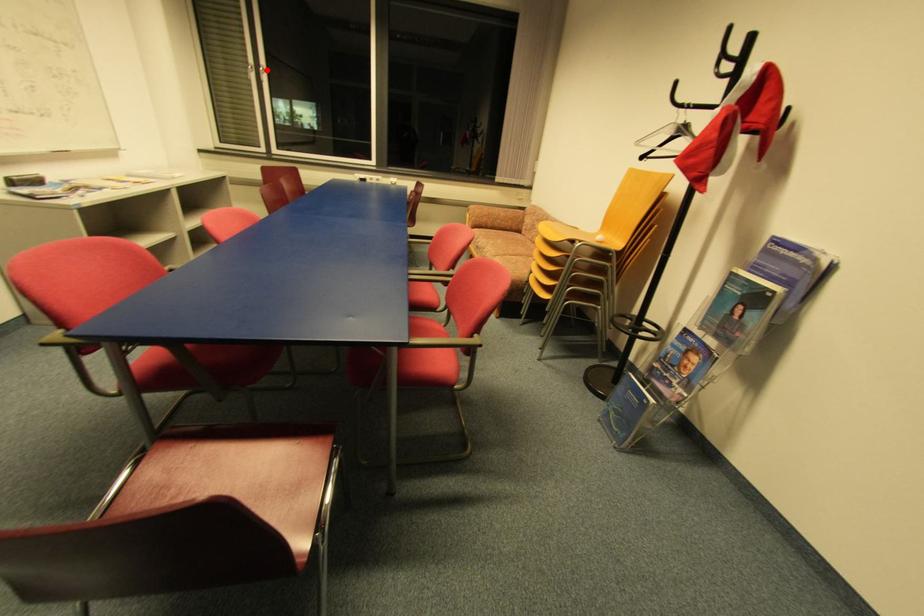
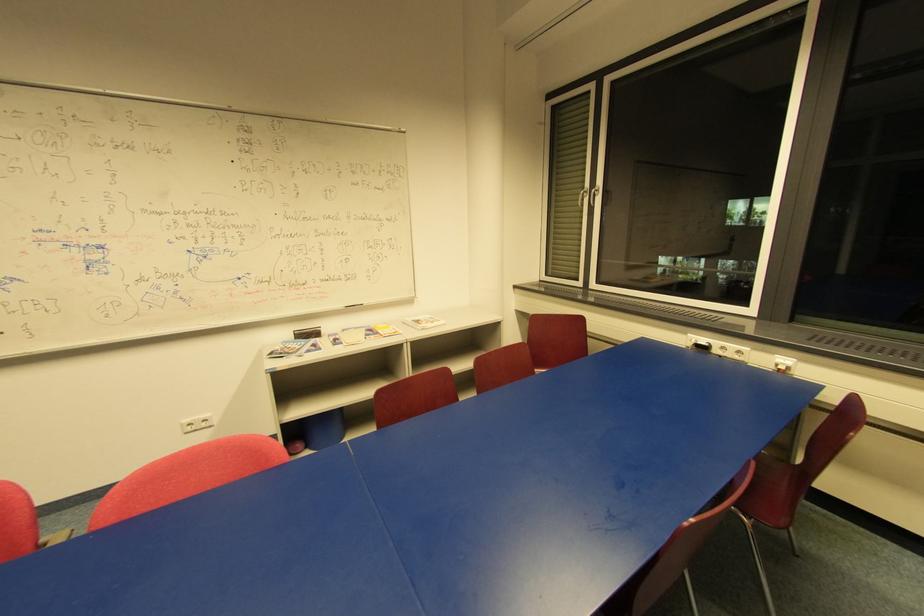
In the second image, find the point that corresponds to the highlighted location in the first image.

(598, 192)